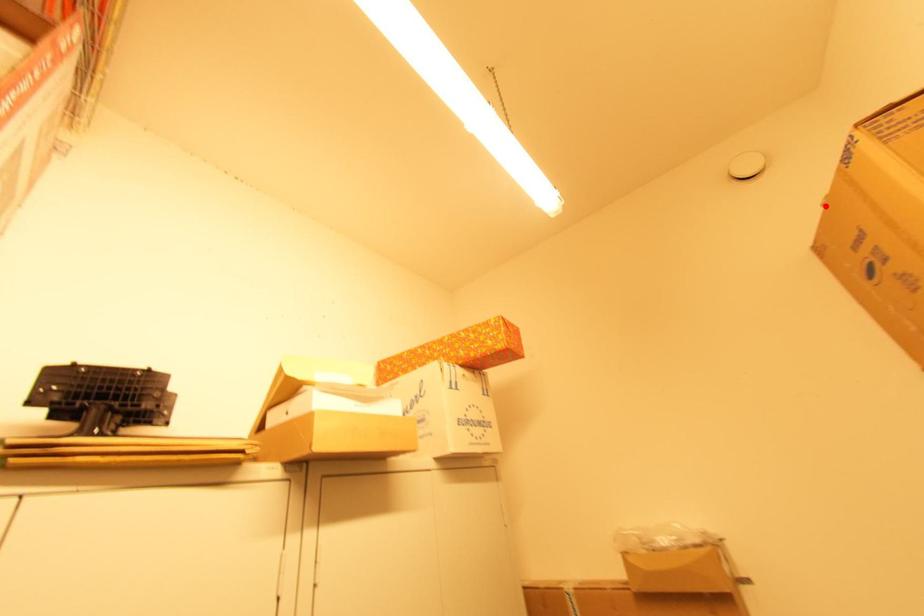
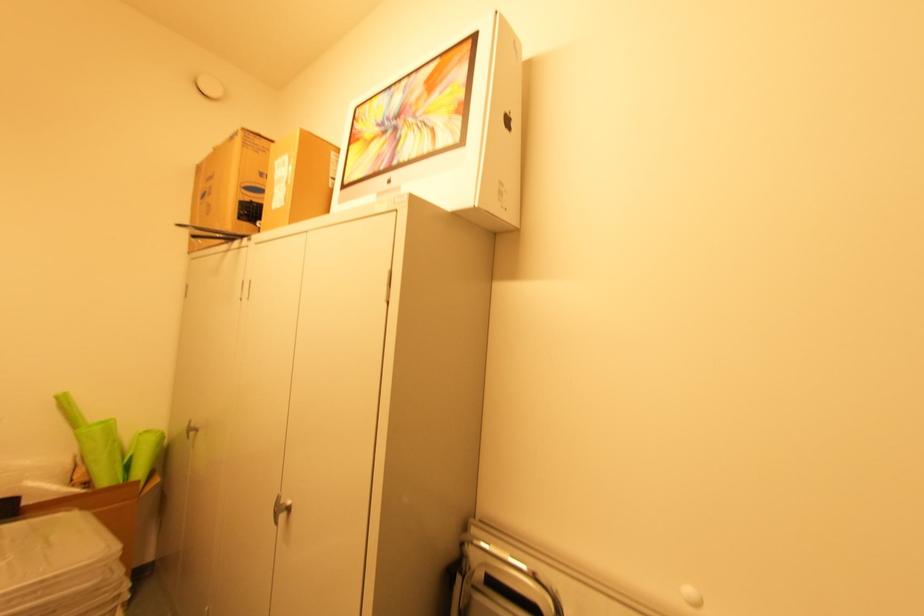
Locate, in the second image, the point that corresponds to the highlighted location in the first image.

(216, 148)